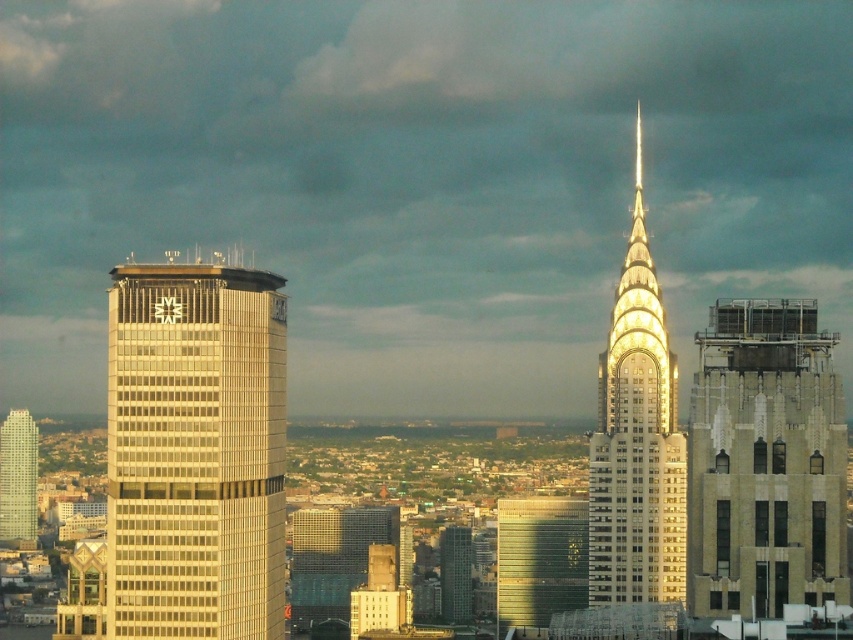
Is shiny gold skyscraper at center further to camera compared to glassy reflective skyscraper at center?

No.

Between shiny gold skyscraper at center and glassy reflective skyscraper at center, which one is positioned lower?

Positioned lower is glassy reflective skyscraper at center.

Which is in front, point (641, 486) or point (457, 538)?

Point (457, 538)

This screenshot has height=640, width=853. What are the coordinates of `shiny gold skyscraper at center` in the screenshot? It's located at (636, 440).

Is silver glass skyscraper at left below metallic glass building at center?

No, silver glass skyscraper at left is not below metallic glass building at center.

Where is `silver glass skyscraper at left`? Image resolution: width=853 pixels, height=640 pixels. silver glass skyscraper at left is located at coordinates (195, 451).

Which is behind, point (236, 458) or point (386, 506)?

The point (236, 458) is more distant.

Where is `silver glass skyscraper at left`? The width and height of the screenshot is (853, 640). silver glass skyscraper at left is located at coordinates (195, 451).

Who is shorter, stone textured building at right or glassy reflective skyscraper at center?

glassy reflective skyscraper at center is shorter.

Does stone textured building at right have a smaller size compared to glassy reflective skyscraper at center?

Actually, stone textured building at right might be larger than glassy reflective skyscraper at center.

Does point (766, 320) lie behind point (465, 621)?

Yes, it is behind point (465, 621).

Locate an element on the screen. The width and height of the screenshot is (853, 640). stone textured building at right is located at coordinates pyautogui.click(x=764, y=461).